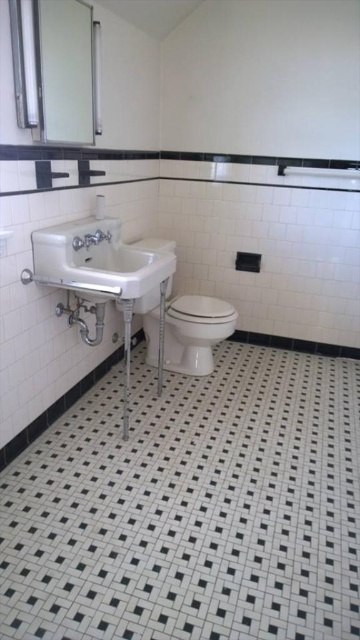
Does white porcelain sink at left appear on the right side of white glossy toilet bowl at center?

Incorrect, white porcelain sink at left is not on the right side of white glossy toilet bowl at center.

Which is behind, point (72, 264) or point (172, 368)?

Point (172, 368)

This screenshot has height=640, width=360. Find the location of `white porcelain sink at left`. white porcelain sink at left is located at coordinates (104, 260).

This screenshot has height=640, width=360. Describe the element at coordinates (191, 508) in the screenshot. I see `black mosaic tile at center` at that location.

Which is more to the right, black mosaic tile at center or white porcelain sink at left?

Positioned to the right is black mosaic tile at center.

Is point (10, 566) positioned before point (43, 228)?

Yes.

Identify the location of black mosaic tile at center. This screenshot has width=360, height=640. (191, 508).

Does black mosaic tile at center have a greater width compared to white glossy toilet bowl at center?

Yes.

How much distance is there between black mosaic tile at center and white glossy toilet bowl at center?

A distance of 22.58 inches exists between black mosaic tile at center and white glossy toilet bowl at center.

Does point (236, 468) lie behind point (198, 353)?

No, (236, 468) is in front of (198, 353).

Find the location of a particular element. Image resolution: width=360 pixels, height=640 pixels. black mosaic tile at center is located at coordinates (191, 508).